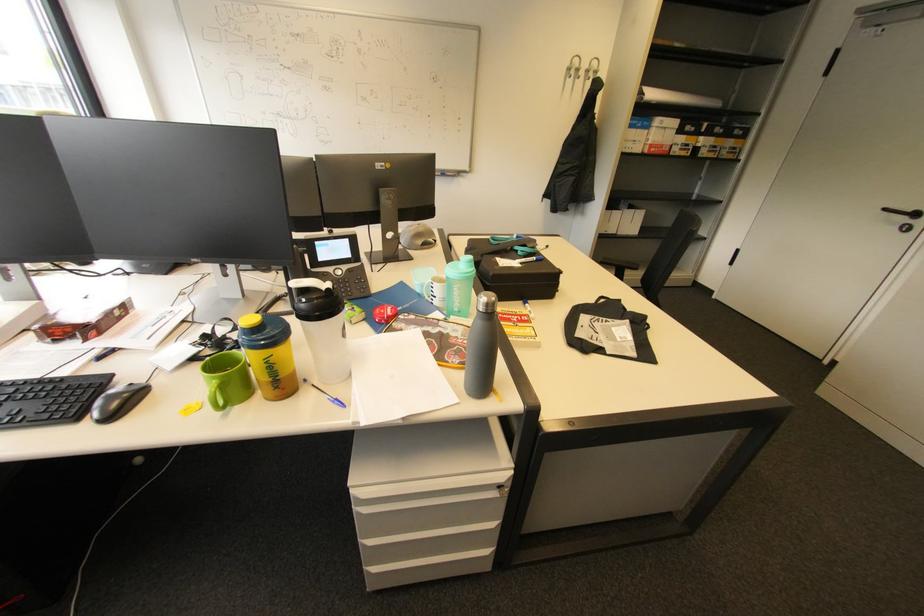
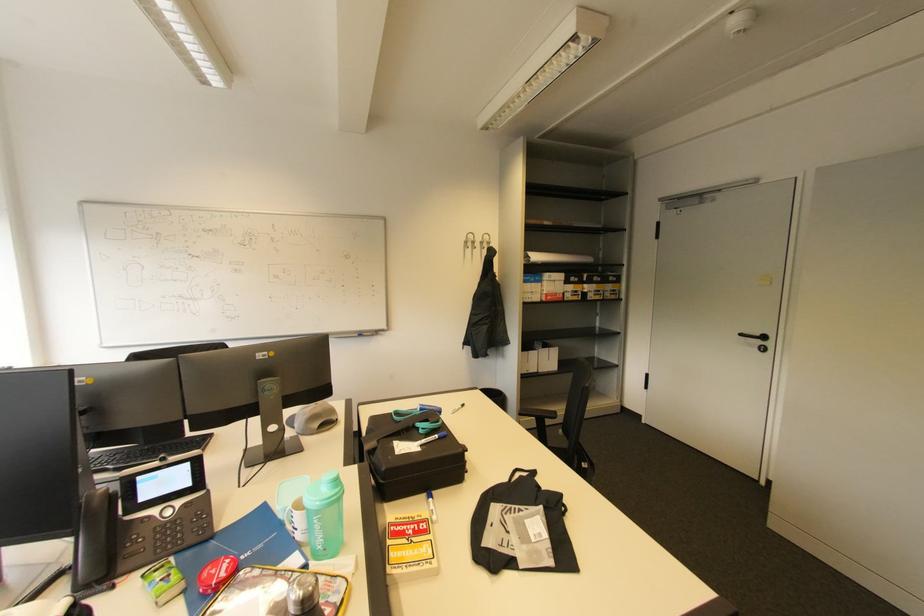
Where in the second image is the point corresponding to (505,267) from the first image?

(402, 455)